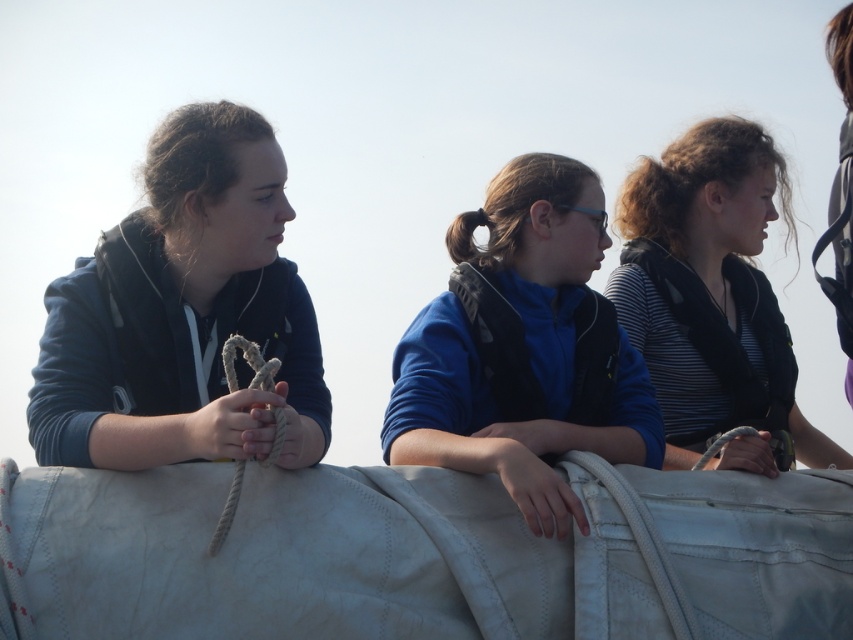
Does matte blue hoodie at left have a lesser height compared to striped fabric shirt at center?

Yes, matte blue hoodie at left is shorter than striped fabric shirt at center.

Based on the photo, is matte blue hoodie at left further to the viewer compared to striped fabric shirt at center?

No, matte blue hoodie at left is in front of striped fabric shirt at center.

Where is `matte blue hoodie at left`? The height and width of the screenshot is (640, 853). matte blue hoodie at left is located at coordinates (183, 312).

Where is `matte blue hoodie at left`? matte blue hoodie at left is located at coordinates (183, 312).

Can you confirm if matte blue hoodie at left is positioned above blue fleece jacket at center?

Correct, matte blue hoodie at left is located above blue fleece jacket at center.

Is point (221, 250) positioned after point (564, 157)?

No, it is in front of (564, 157).

Is point (305, 353) less distant than point (428, 330)?

Yes, it is.

This screenshot has width=853, height=640. Identify the location of matte blue hoodie at left. (183, 312).

Where is `blue fleece jacket at center`? The height and width of the screenshot is (640, 853). blue fleece jacket at center is located at coordinates (523, 349).

What do you see at coordinates (523, 349) in the screenshot? I see `blue fleece jacket at center` at bounding box center [523, 349].

The image size is (853, 640). In order to click on blue fleece jacket at center in this screenshot , I will do `click(523, 349)`.